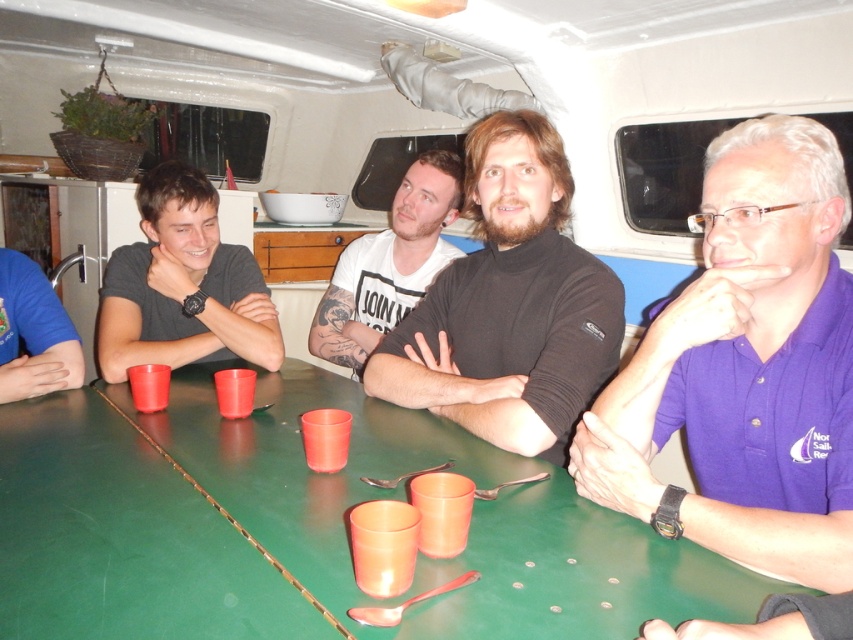
You are a photographer trying to capture a photo of the purple cotton shirt at right and the translucent orange cup at center. Which object should you focus on first if you want to ensure both are in focus without adjusting the camera settings?

The purple cotton shirt at right is taller than the translucent orange cup at center, so focusing on the purple cotton shirt at right first would ensure both are within the depth of field.

You are taking a photo of the scene and want to focus on both the point at point (194,394) and point (334,436). Which point should you focus on first to ensure both are in focus?

You should focus on point (194,394) first because it is closer to the camera than point (334,436). By focusing on the closer point, the farther point will also be in focus due to the depth of field.

You are standing in the boat and want to place a 28 inch long object on the green plastic table at center. Can the object fit on the table?

The distance between you and the green plastic table at center is 30.32 inches, but this measurement refers to the distance between the viewer and the table, not the table size. The table size is not provided, so it is impossible to determine if the object will fit.